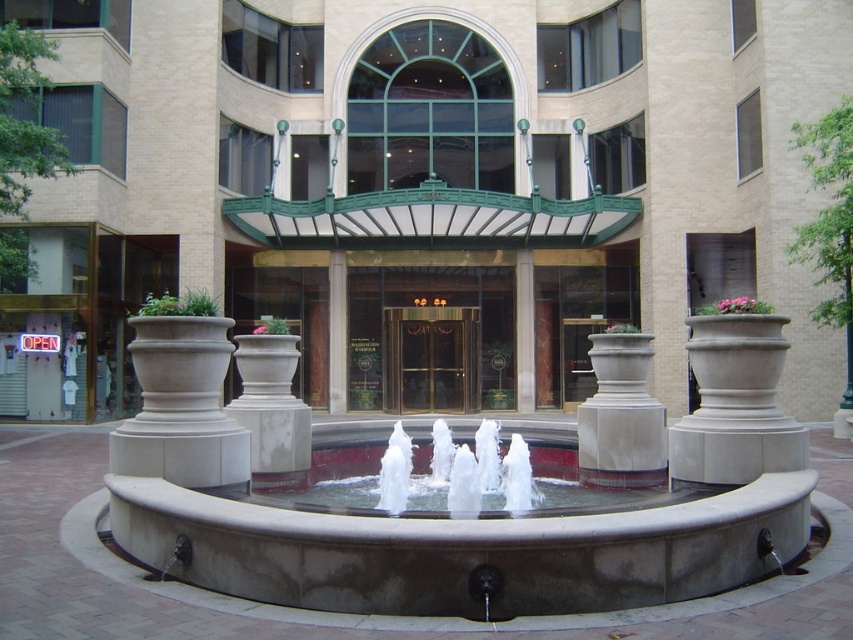
Question: Which point is farther from the camera taking this photo?

Choices:
 (A) (277, 536)
 (B) (693, 376)
 (C) (410, 392)

Answer: (C)

Question: Does smooth concrete fountain at center appear under white concrete planter at center?

Choices:
 (A) no
 (B) yes

Answer: (B)

Question: Which point is closer to the camera?

Choices:
 (A) (718, 288)
 (B) (490, 408)
 (C) (532, 566)

Answer: (C)

Question: Observing the image, what is the correct spatial positioning of smooth concrete fountain at center in reference to gold/glass revolving door at center?

Choices:
 (A) left
 (B) right

Answer: (B)

Question: Among these objects, which one is farthest from the camera?

Choices:
 (A) white concrete planter at center
 (B) smooth concrete fountain at center
 (C) gold/glass revolving door at center

Answer: (C)

Question: Is smooth concrete fountain at center to the left of gold/glass revolving door at center from the viewer's perspective?

Choices:
 (A) yes
 (B) no

Answer: (B)